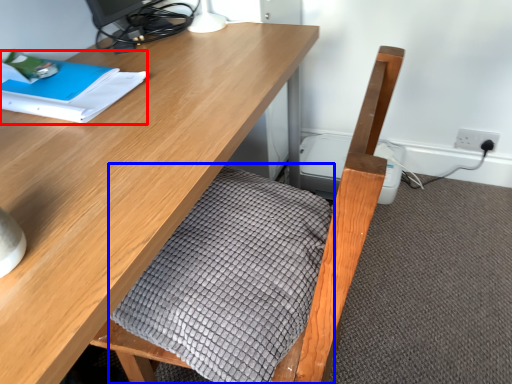
Question: Among these objects, which one is nearest to the camera, notebook (highlighted by a red box) or blanket (highlighted by a blue box)?

Choices:
 (A) notebook
 (B) blanket

Answer: (B)